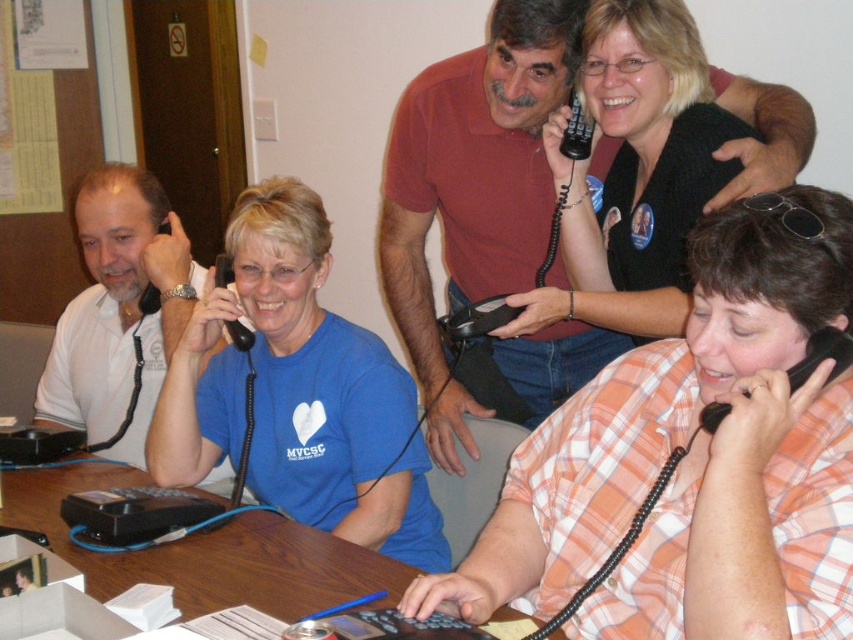
Question: Based on their relative distances, which object is nearer to the orange plaid shirt at lower right?

Choices:
 (A) matte red shirt at upper center
 (B) brown wooden table at center

Answer: (B)

Question: Does orange plaid shirt at lower right appear on the right side of blue matte shirt at center?

Choices:
 (A) no
 (B) yes

Answer: (B)

Question: Which of the following is the farthest from the observer?

Choices:
 (A) (782, 227)
 (B) (413, 328)
 (C) (122, 250)
 (D) (450, 499)

Answer: (C)

Question: Does matte red shirt at upper center have a lesser width compared to brown wooden table at center?

Choices:
 (A) no
 (B) yes

Answer: (B)

Question: Which point is closer to the camera?

Choices:
 (A) (375, 445)
 (B) (712, 529)

Answer: (B)

Question: Is orange plaid shirt at lower right below brown wooden table at center?

Choices:
 (A) no
 (B) yes

Answer: (A)